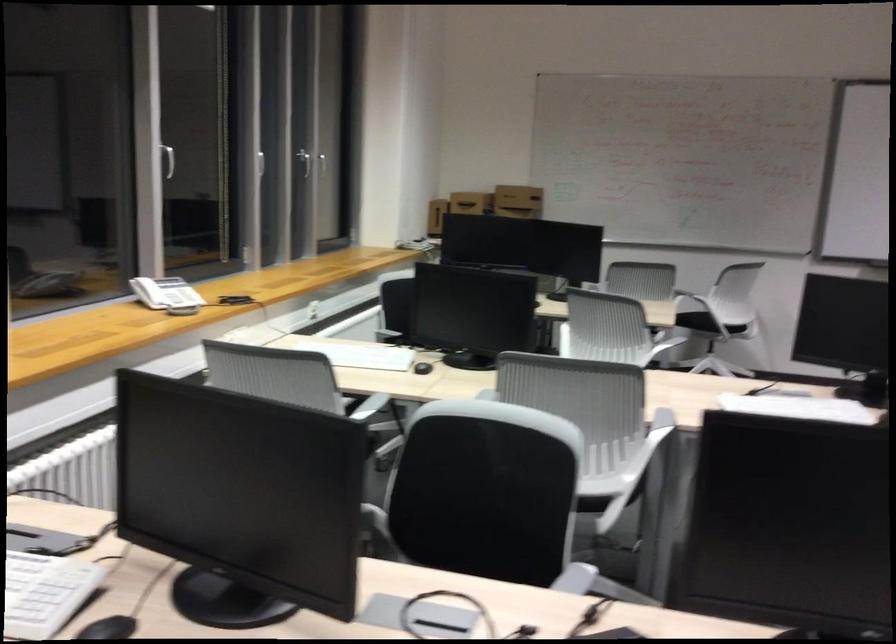
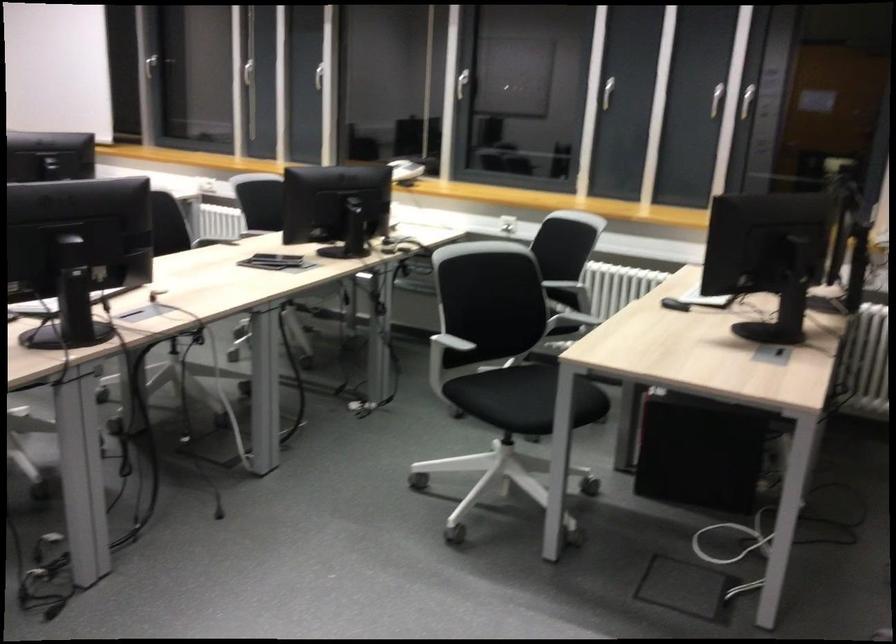
Find the pixel in the second image that matches pixel 131 305 in the first image.

(400, 163)